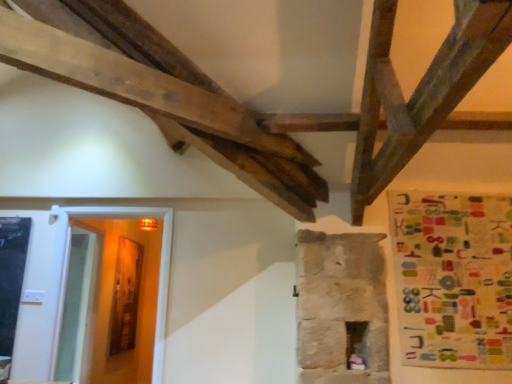
Question: Does transparent glass door at lower left have a larger size compared to multicolored fabric poster at right?

Choices:
 (A) yes
 (B) no

Answer: (A)

Question: Is transparent glass door at lower left next to multicolored fabric poster at right and touching it?

Choices:
 (A) no
 (B) yes

Answer: (A)

Question: From the image's perspective, is transparent glass door at lower left located above multicolored fabric poster at right?

Choices:
 (A) yes
 (B) no

Answer: (B)

Question: Could you tell me if transparent glass door at lower left is turned towards multicolored fabric poster at right?

Choices:
 (A) no
 (B) yes

Answer: (A)

Question: From a real-world perspective, is transparent glass door at lower left under multicolored fabric poster at right?

Choices:
 (A) yes
 (B) no

Answer: (A)

Question: Is transparent glass door at lower left at the left side of multicolored fabric poster at right?

Choices:
 (A) yes
 (B) no

Answer: (A)

Question: Does multicolored fabric poster at right have a greater height compared to transparent glass door at lower left?

Choices:
 (A) yes
 (B) no

Answer: (B)

Question: Is multicolored fabric poster at right facing towards transparent glass door at lower left?

Choices:
 (A) yes
 (B) no

Answer: (B)

Question: Is the position of multicolored fabric poster at right less distant than that of transparent glass door at lower left?

Choices:
 (A) yes
 (B) no

Answer: (A)

Question: Is multicolored fabric poster at right outside of transparent glass door at lower left?

Choices:
 (A) no
 (B) yes

Answer: (B)

Question: Is multicolored fabric poster at right looking in the opposite direction of transparent glass door at lower left?

Choices:
 (A) no
 (B) yes

Answer: (A)

Question: Does multicolored fabric poster at right have a lesser height compared to transparent glass door at lower left?

Choices:
 (A) no
 (B) yes

Answer: (B)

Question: From a real-world perspective, is multicolored fabric poster at right physically located above or below transparent glass door at lower left?

Choices:
 (A) below
 (B) above

Answer: (B)